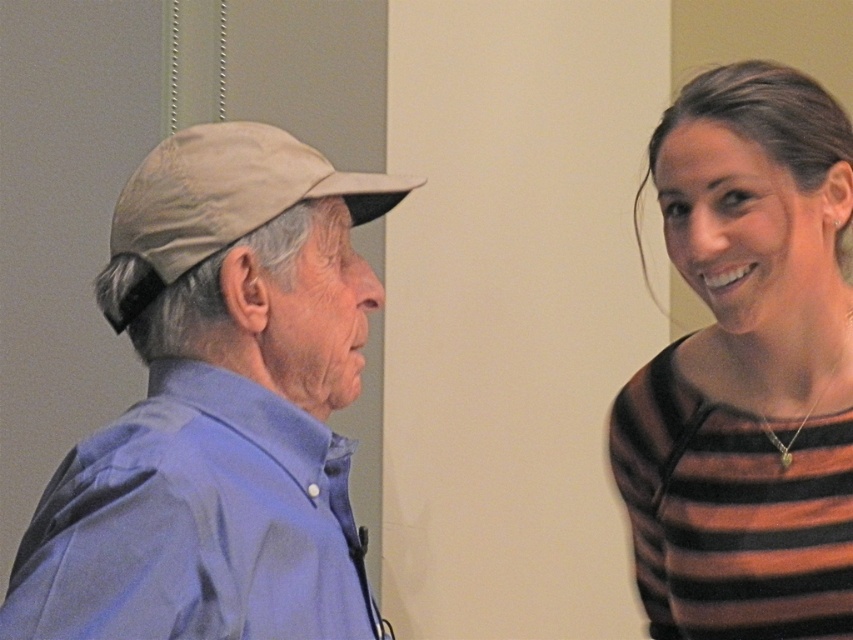
You are an interior designer assessing the placement of two items in a room. The items are the matte khaki cap at left and the brown striped sweater at right. Based on the scene description, which item is positioned higher up in the image?

The matte khaki cap at left is positioned higher up in the image than the brown striped sweater at right.

You are a photographer setting up for a portrait. You need to position a spotlight so that it illuminates both the brown striped sweater at right and the blue smooth shirt at left without casting shadows on the green door. Based on their positions, where should you place the spotlight relative to the subjects?

The blue smooth shirt at left is behind brown striped sweater at right, so the spotlight should be placed in front of the brown striped sweater at right to ensure both are illuminated without casting shadows on the green door.